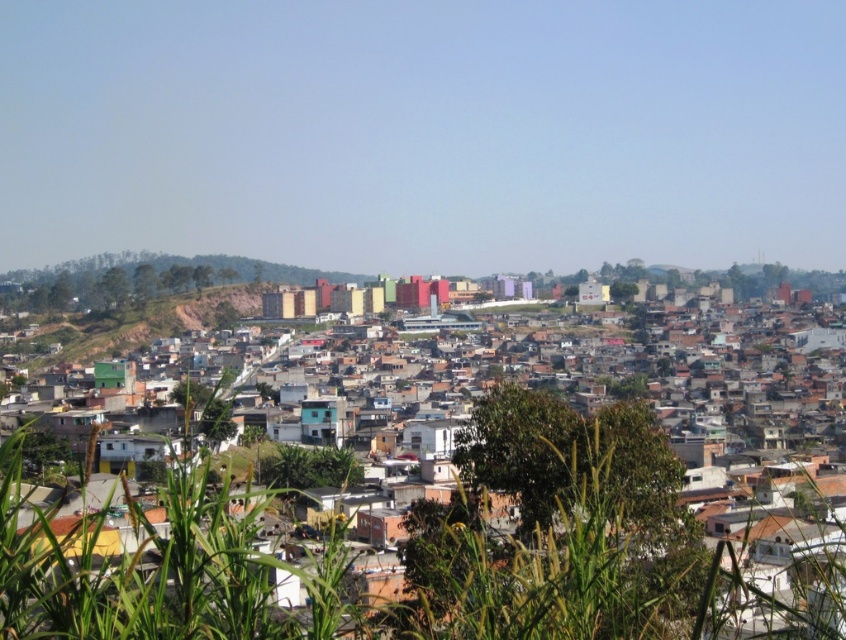
You are a delivery drone operator. Your drone has a wingspan of 1.2 meters. You need to navigate between the multicolored buildings at center and the brown dirt at left to deliver a package. Is there enough space for your drone to pass through?

The multicolored buildings at center might be wider than brown dirt at left, so there may not be enough space for the drone to pass through safely. It is recommended to choose a different route or verify the exact dimensions before proceeding.

You are standing on a hill overlooking the urban area and want to take a photo of the multicolored buildings at center. If your camera has a maximum focus range of 70 meters, will it be able to capture the buildings clearly?

The multicolored buildings at center is 72.65 meters away from viewer. Since the distance exceeds the camera maximum focus range of 70 meters, the camera cannot capture the buildings clearly.